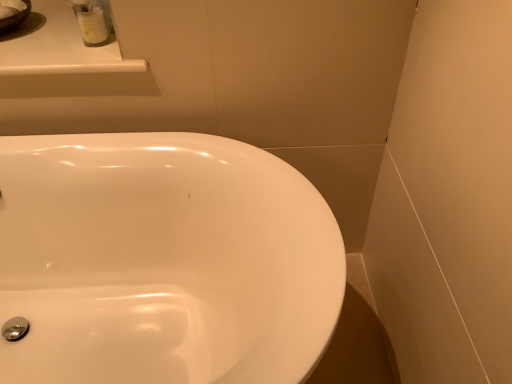
Question: From a real-world perspective, is white glossy container at upper left physically below white glossy sink at center?

Choices:
 (A) yes
 (B) no

Answer: (B)

Question: Is white glossy container at upper left shorter than white glossy sink at center?

Choices:
 (A) no
 (B) yes

Answer: (B)

Question: Is the position of white glossy container at upper left more distant than that of white glossy sink at center?

Choices:
 (A) yes
 (B) no

Answer: (A)

Question: Is white glossy container at upper left surrounding white glossy sink at center?

Choices:
 (A) yes
 (B) no

Answer: (B)

Question: Considering the relative sizes of white glossy container at upper left and white glossy sink at center in the image provided, is white glossy container at upper left wider than white glossy sink at center?

Choices:
 (A) yes
 (B) no

Answer: (B)

Question: From the image's perspective, does white glossy container at upper left appear lower than white glossy sink at center?

Choices:
 (A) no
 (B) yes

Answer: (A)

Question: From the image's perspective, is white glossy sink at center located beneath white glossy container at upper left?

Choices:
 (A) no
 (B) yes

Answer: (B)

Question: Considering the relative sizes of white glossy sink at center and white glossy container at upper left in the image provided, is white glossy sink at center shorter than white glossy container at upper left?

Choices:
 (A) yes
 (B) no

Answer: (B)

Question: Could you tell me if white glossy sink at center is facing white glossy container at upper left?

Choices:
 (A) yes
 (B) no

Answer: (B)

Question: From a real-world perspective, is white glossy sink at center located beneath white glossy container at upper left?

Choices:
 (A) no
 (B) yes

Answer: (B)

Question: Is white glossy sink at center outside white glossy container at upper left?

Choices:
 (A) yes
 (B) no

Answer: (A)

Question: Does white glossy sink at center appear on the right side of white glossy container at upper left?

Choices:
 (A) no
 (B) yes

Answer: (B)

Question: Is white glossy counter top at upper left behind white glossy container at upper left?

Choices:
 (A) yes
 (B) no

Answer: (B)